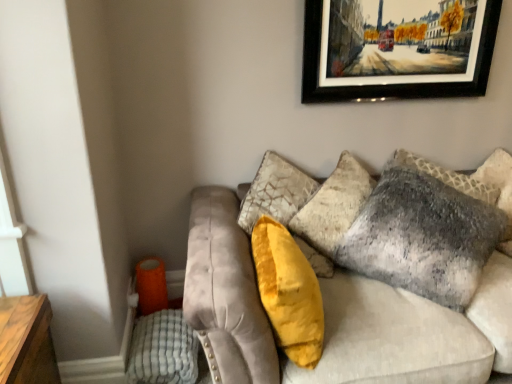
From a real-world perspective, what is the 2D location of a free space above wooden-framed painting at upper center? Please provide its 2D coordinates.

[(0.805, -0.000)]